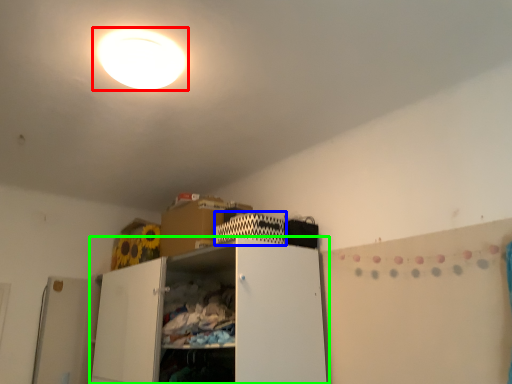
Question: Based on their relative distances, which object is farther from lamp (highlighted by a red box)? Choose from cabinet (highlighted by a blue box) and cabinetry (highlighted by a green box).

Choices:
 (A) cabinet
 (B) cabinetry

Answer: (B)